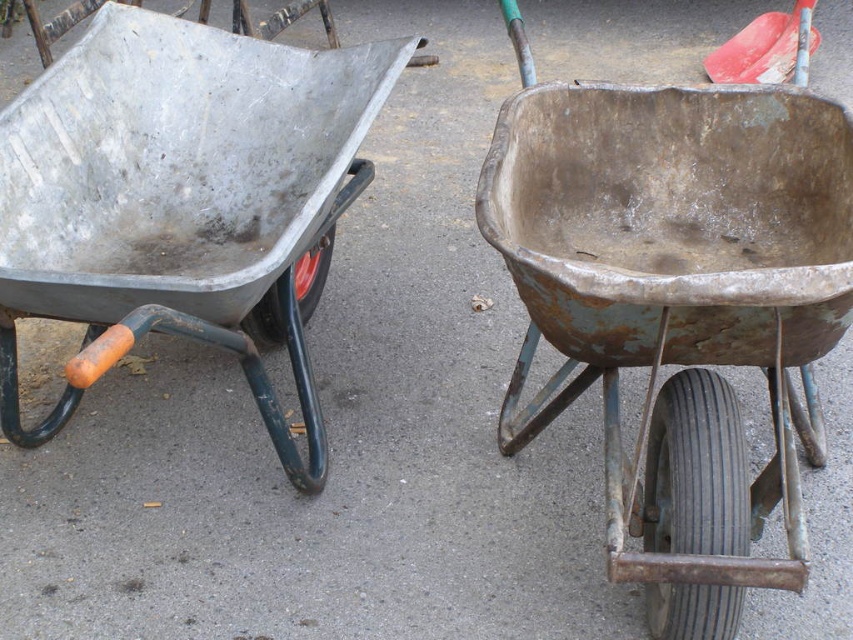
Question: Which of these objects is positioned farthest from the metallic gray wheelbarrow at left?

Choices:
 (A) smooth red shovel at upper right
 (B) rusty metal wheelbarrow at center

Answer: (A)

Question: Which point is farther to the camera?

Choices:
 (A) metallic gray wheelbarrow at left
 (B) rusty metal wheelbarrow at center
 (C) smooth red shovel at upper right

Answer: (C)

Question: Does metallic gray wheelbarrow at left appear under smooth red shovel at upper right?

Choices:
 (A) no
 (B) yes

Answer: (B)

Question: Can you confirm if rusty metal wheelbarrow at center is wider than smooth red shovel at upper right?

Choices:
 (A) no
 (B) yes

Answer: (B)

Question: Which object is the closest to the smooth red shovel at upper right?

Choices:
 (A) rusty metal wheelbarrow at center
 (B) metallic gray wheelbarrow at left

Answer: (A)

Question: Is rusty metal wheelbarrow at center smaller than metallic gray wheelbarrow at left?

Choices:
 (A) no
 (B) yes

Answer: (B)